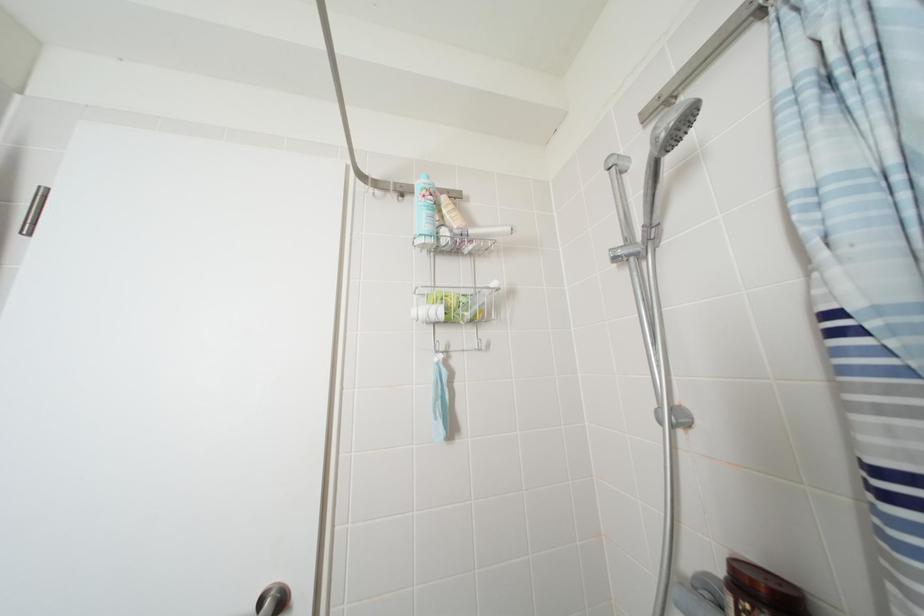
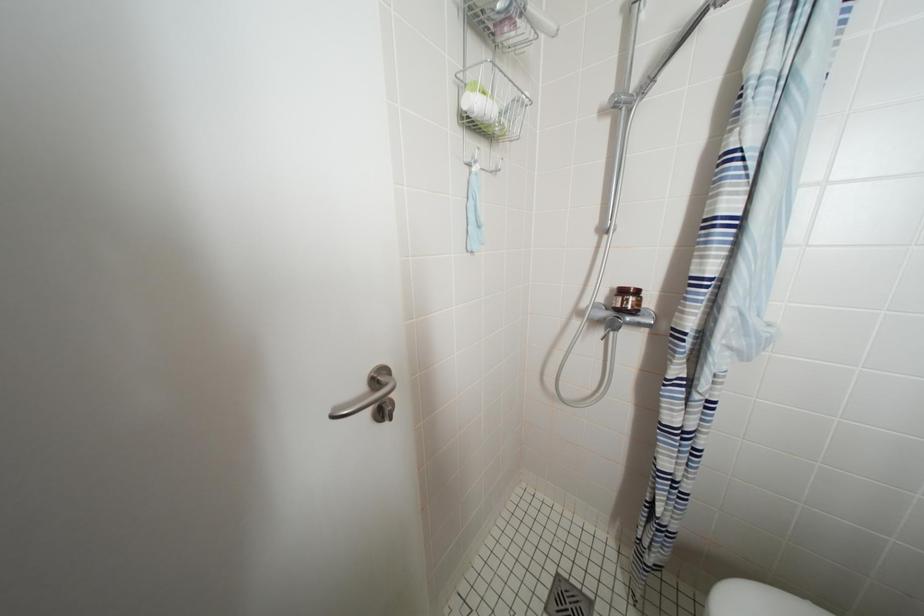
Looking at this image, based on the continuous images, in which direction is the camera rotating?

The rotation direction of the camera is right-down.